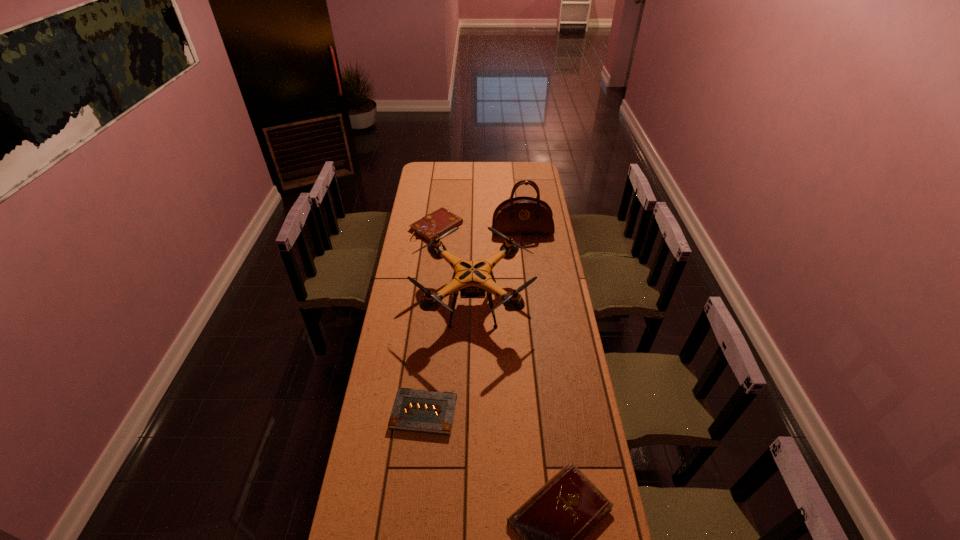
Find the location of `handbag`. handbag is located at coordinates (521, 215).

The width and height of the screenshot is (960, 540). Identify the location of the third farthest object. (472, 278).

Find the location of a particular element. The image size is (960, 540). drone is located at coordinates (472, 278).

The height and width of the screenshot is (540, 960). I want to click on the tallest notebook, so click(x=437, y=223).

This screenshot has width=960, height=540. What are the coordinates of `the third shortest object` in the screenshot? It's located at (437, 223).

What are the coordinates of `the fourth farthest object` in the screenshot? It's located at (423, 411).

At what (x,y) coordinates should I click in order to perform the action: click on free location located on the front-facing side of the tallest object. Please return your answer as a coordinate pair (x, y). Image resolution: width=960 pixels, height=540 pixels. Looking at the image, I should click on (525, 250).

I want to click on vacant space located 0.050m on the camera mount of the drone, so click(x=542, y=303).

This screenshot has height=540, width=960. In order to click on vacant region located 0.180m on the back of the tallest notebook in this screenshot , I will do pos(441,194).

This screenshot has height=540, width=960. I want to click on blank space located on the back of the fourth farthest object, so click(433, 328).